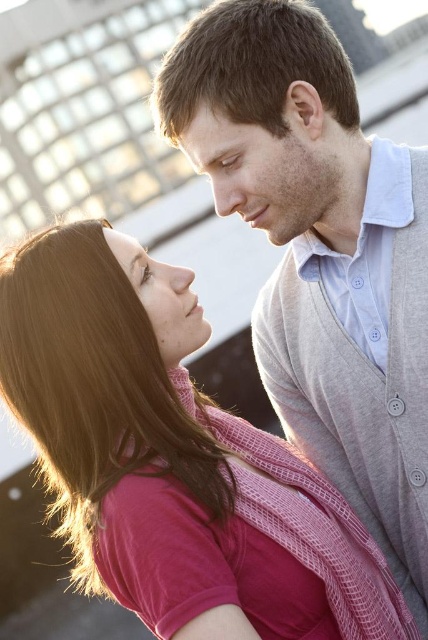
Question: Is pink knitted sweater at center to the left of light gray knit sweater at upper right from the viewer's perspective?

Choices:
 (A) yes
 (B) no

Answer: (A)

Question: Is pink knitted sweater at center bigger than light gray knit sweater at upper right?

Choices:
 (A) no
 (B) yes

Answer: (B)

Question: Which object is positioned farthest from the matte skin forehead at upper center?

Choices:
 (A) pink knitted sweater at center
 (B) light gray knit sweater at upper right

Answer: (A)

Question: Which object is farther from the camera taking this photo?

Choices:
 (A) light gray knit sweater at upper right
 (B) matte skin forehead at upper center
 (C) pink knitted sweater at center

Answer: (B)

Question: Can you confirm if pink knitted sweater at center is positioned below matte skin forehead at upper center?

Choices:
 (A) yes
 (B) no

Answer: (A)

Question: Which point is closer to the camera taking this photo?

Choices:
 (A) (339, 416)
 (B) (5, 292)
 (C) (241, 152)

Answer: (B)